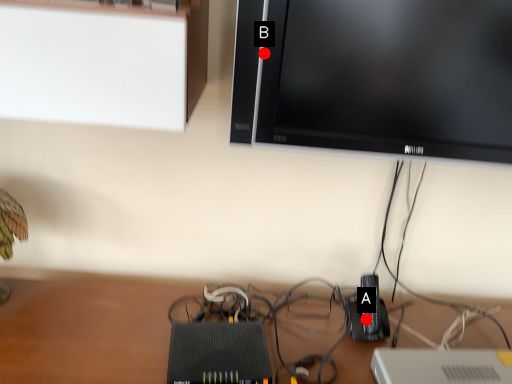
Question: Two points are circled on the image, labeled by A and B beside each circle. Which point appears farthest from the camera in this image?

Choices:
 (A) A is further
 (B) B is further

Answer: (A)